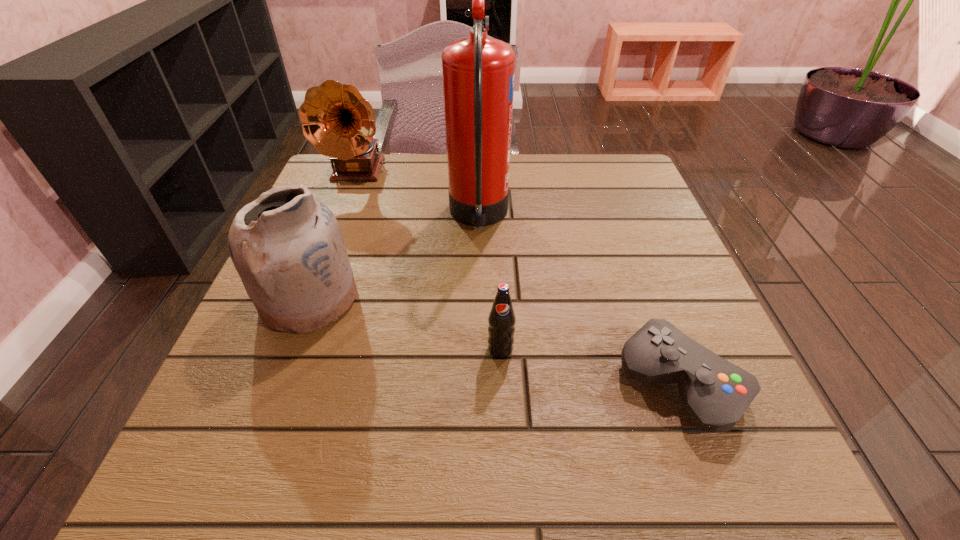
Image resolution: width=960 pixels, height=540 pixels. In order to click on vacant space at the near edge of the desktop in this screenshot , I will do `click(416, 469)`.

In the image, there is a desktop. Where is `vacant space at the left edge`? vacant space at the left edge is located at coordinates (213, 403).

At what (x,y) coordinates should I click in order to perform the action: click on free location at the right edge of the desktop. Please return your answer as a coordinate pair (x, y). The height and width of the screenshot is (540, 960). Looking at the image, I should click on (626, 252).

Find the location of `free space at the far left corner of the desktop`. free space at the far left corner of the desktop is located at coordinates (352, 200).

Locate an element on the screen. The height and width of the screenshot is (540, 960). vacant space at the far right corner of the desktop is located at coordinates (604, 168).

The height and width of the screenshot is (540, 960). In order to click on free region at the near right corner of the desktop in this screenshot , I will do `click(682, 456)`.

Locate an element on the screen. Image resolution: width=960 pixels, height=540 pixels. vacant point located between the pottery and the tallest object is located at coordinates (394, 258).

Where is `empty space that is in between the tallest object and the phonograph_record`? Image resolution: width=960 pixels, height=540 pixels. empty space that is in between the tallest object and the phonograph_record is located at coordinates (418, 194).

Find the location of a particular element. The image size is (960, 540). free space between the second shortest object and the rightmost object is located at coordinates (590, 366).

You are a GUI agent. You are given a task and a screenshot of the screen. Output one action in this format:
    pyautogui.click(x=<x>, y=<y>)
    Task: Click on the empty space between the second shortest object and the shortest object
    The image size is (960, 540).
    Given the screenshot: What is the action you would take?
    pyautogui.click(x=590, y=366)